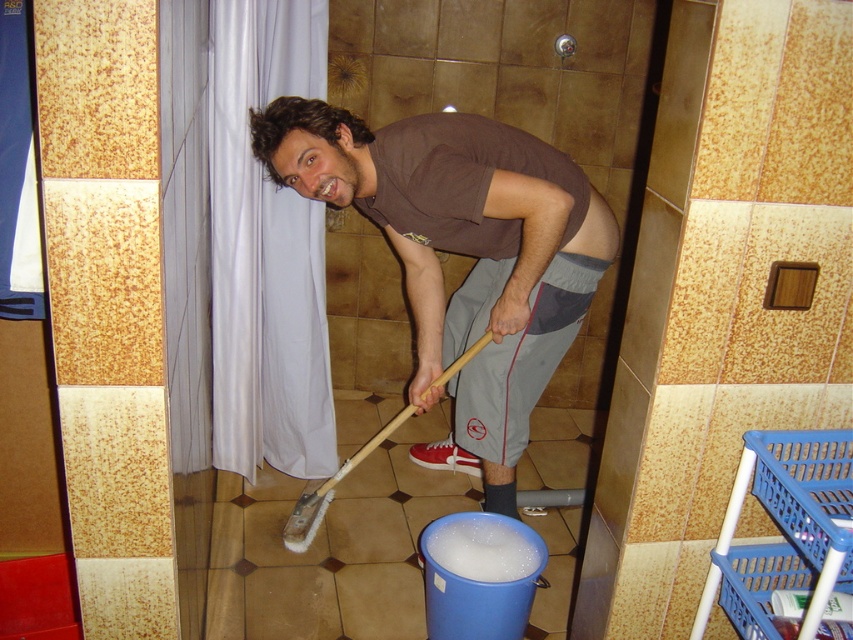
Between point (497, 488) and point (399, 424), which one is positioned behind?

The point (399, 424) is behind.

Does brown cotton t-shirt at center come in front of white bristle mop at lower center?

Yes, brown cotton t-shirt at center is closer to the viewer.

Who is more distant from viewer, (509, 460) or (358, 460)?

The point (358, 460) is more distant.

Where is `brown cotton t-shirt at center`? The height and width of the screenshot is (640, 853). brown cotton t-shirt at center is located at coordinates (x=461, y=252).